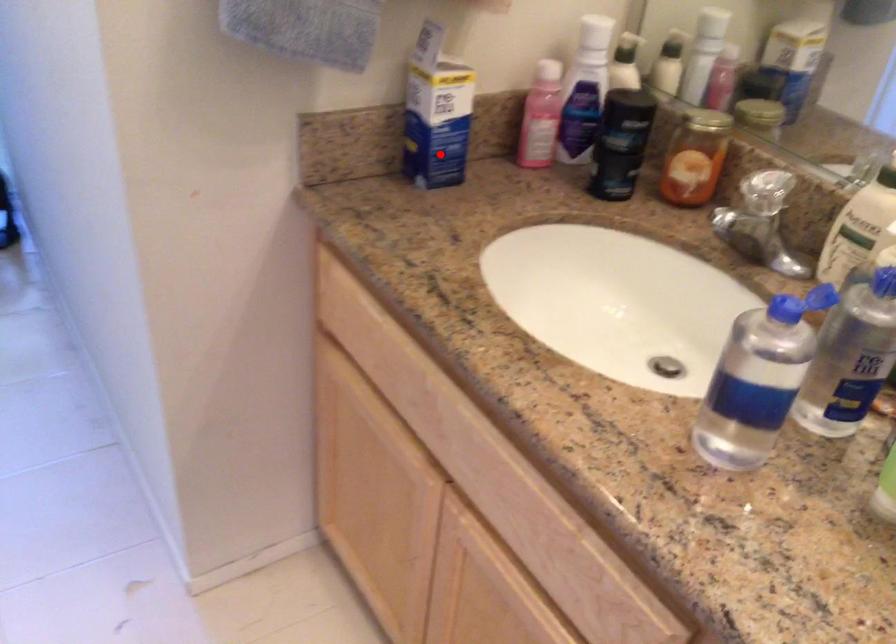
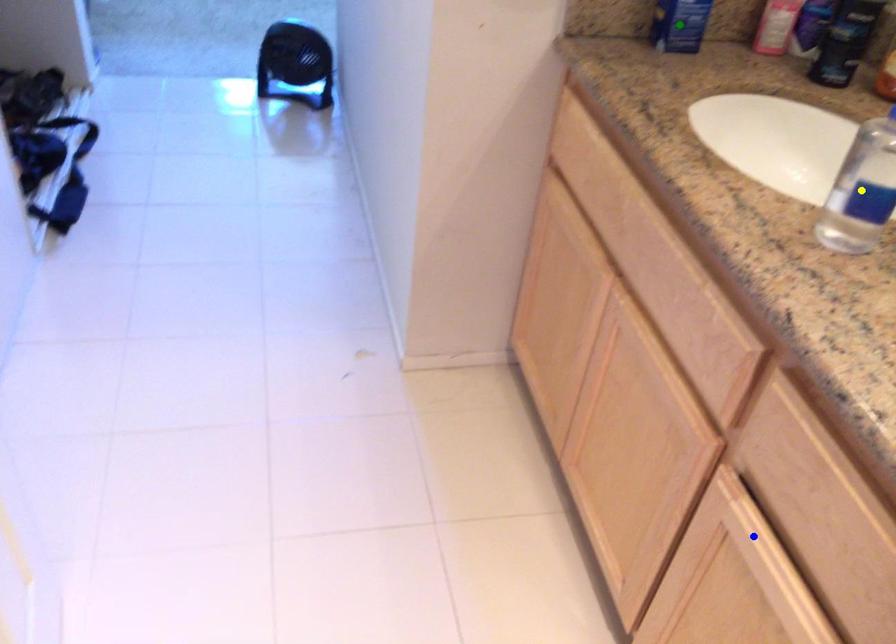
Question: I am providing you with two images of the same scene from different viewpoints. A red point is marked on the first image. You are given multiple points on the second image. Can you choose the point in image 2 that corresponds to the point in image 1?

Choices:
 (A) green point
 (B) yellow point
 (C) blue point

Answer: (A)